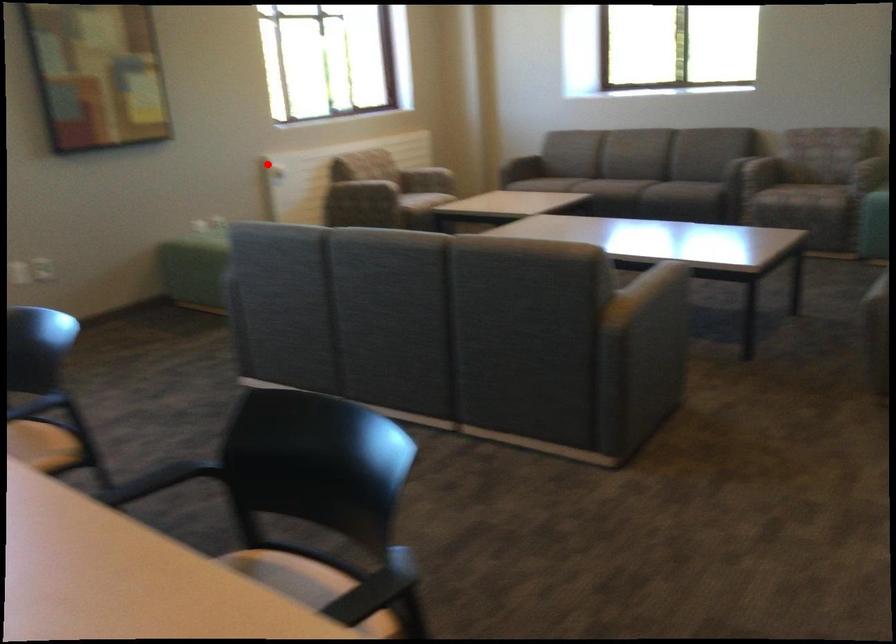
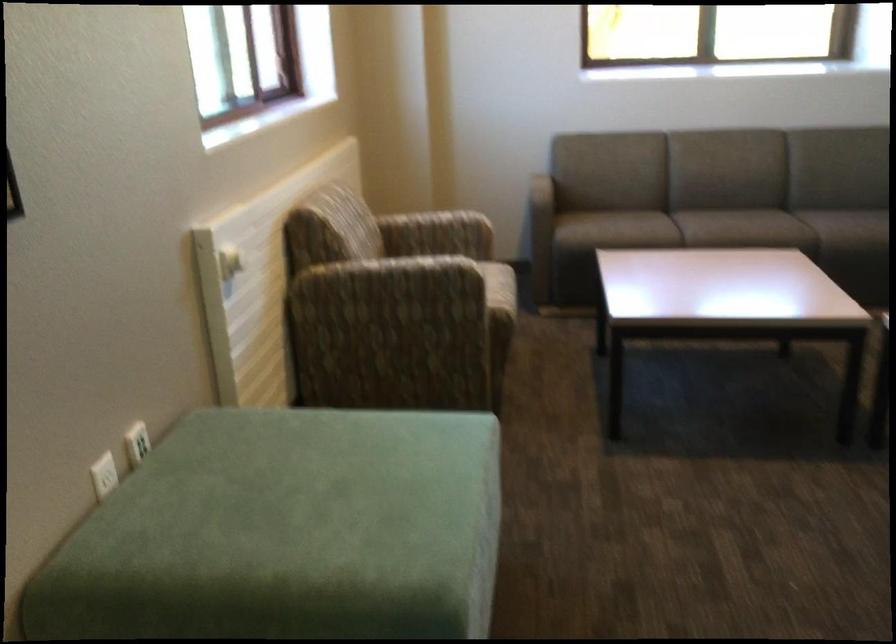
In the second image, find the point that corresponds to the highlighted location in the first image.

(229, 263)